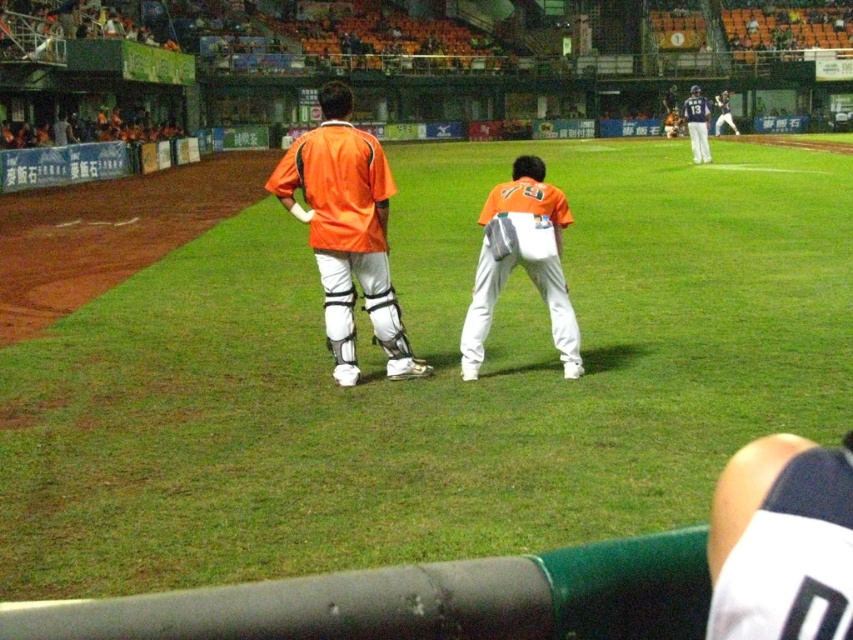
Question: Which point appears farthest from the camera in this image?

Choices:
 (A) (700, 131)
 (B) (728, 99)
 (C) (550, 221)
 (D) (779, 576)

Answer: (B)

Question: Which point is closer to the camera?

Choices:
 (A) white matte uniform at upper right
 (B) orange matte jersey at center
 (C) white matte pants at center
 (D) orange matte baseball uniform at center

Answer: (C)

Question: Considering the real-world distances, which object is farthest from the orange matte baseball uniform at center?

Choices:
 (A) orange jersey at center
 (B) white matte baseball uniform at center
 (C) orange matte jersey at center
 (D) white matte uniform at upper right

Answer: (A)

Question: Does orange matte jersey at center lie in front of white matte uniform at upper right?

Choices:
 (A) yes
 (B) no

Answer: (A)

Question: Is white matte pants at center thinner than orange jersey at center?

Choices:
 (A) yes
 (B) no

Answer: (B)

Question: Does white matte baseball uniform at center have a larger size compared to orange jersey at center?

Choices:
 (A) no
 (B) yes

Answer: (A)